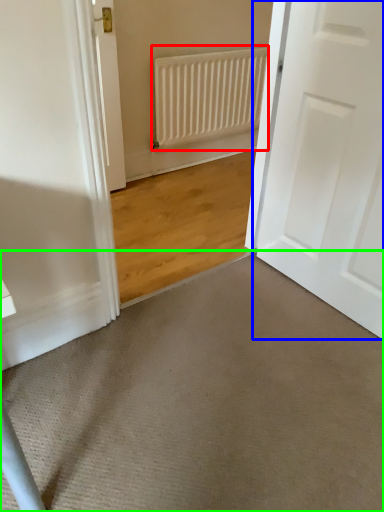
Question: Considering the real-world distances, which object is closest to radiator (highlighted by a red box)? door (highlighted by a blue box) or doormat (highlighted by a green box).

Choices:
 (A) door
 (B) doormat

Answer: (A)